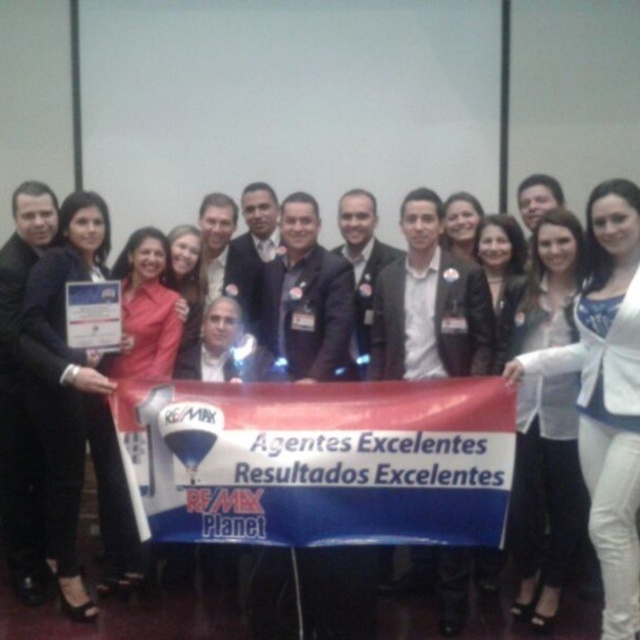
Describe the element at coordinates (605, 394) in the screenshot. I see `white glossy blazer at center` at that location.

The image size is (640, 640). What do you see at coordinates (605, 394) in the screenshot?
I see `white glossy blazer at center` at bounding box center [605, 394].

Locate an element on the screen. Image resolution: width=640 pixels, height=640 pixels. white glossy blazer at center is located at coordinates (605, 394).

Does blue fabric banner at center appear on the left side of white glossy blazer at center?

Indeed, blue fabric banner at center is positioned on the left side of white glossy blazer at center.

Can you confirm if blue fabric banner at center is positioned to the right of white glossy blazer at center?

No, blue fabric banner at center is not to the right of white glossy blazer at center.

Between point (150, 529) and point (627, 182), which one is positioned behind?

Positioned behind is point (150, 529).

At what (x,y) coordinates should I click in order to perform the action: click on blue fabric banner at center. Please return your answer as a coordinate pair (x, y). The image size is (640, 640). Looking at the image, I should click on (317, 461).

Does blue fabric banner at center lie in front of white glossy shirt at center?

Yes, blue fabric banner at center is closer to the viewer.

Between point (410, 454) and point (572, 628), which one is positioned behind?

Point (572, 628)

Does point (259, 413) lie in front of point (4, 618)?

Yes, it is in front of point (4, 618).

Locate an element on the screen. This screenshot has height=640, width=640. blue fabric banner at center is located at coordinates (317, 461).